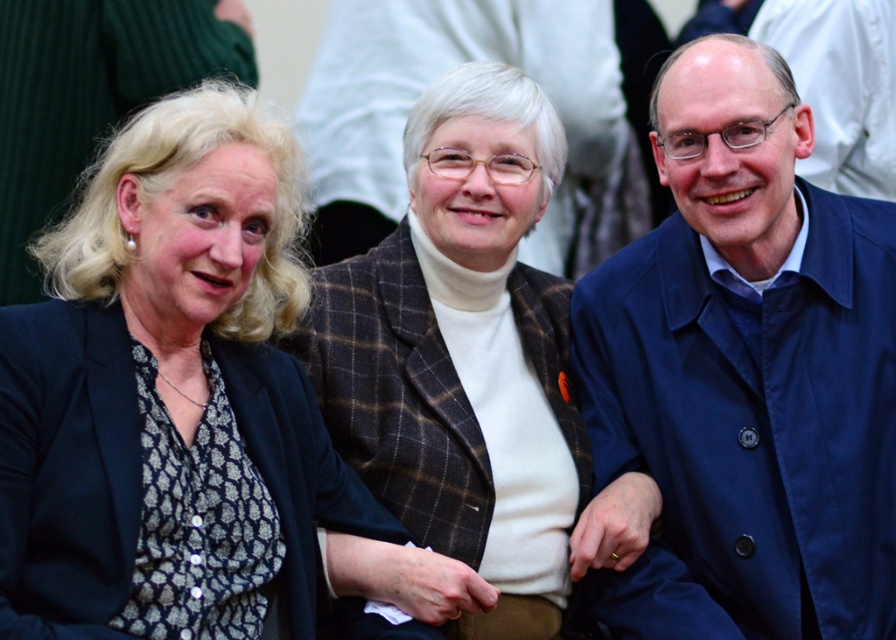
Who is shorter, matte black blazer at left or brown plaid blazer at center?

With less height is matte black blazer at left.

Who is positioned more to the right, matte black blazer at left or brown plaid blazer at center?

brown plaid blazer at center

Is point (102, 204) farther from viewer compared to point (507, 285)?

No, (102, 204) is in front of (507, 285).

Where is `matte black blazer at left`? Image resolution: width=896 pixels, height=640 pixels. matte black blazer at left is located at coordinates (164, 378).

Is blue fabric coat at right to the left of brown plaid blazer at center from the viewer's perspective?

No, blue fabric coat at right is not to the left of brown plaid blazer at center.

Is blue fabric coat at right bigger than brown plaid blazer at center?

No, blue fabric coat at right is not bigger than brown plaid blazer at center.

Where is `blue fabric coat at right`? The height and width of the screenshot is (640, 896). blue fabric coat at right is located at coordinates point(746,372).

Which of these two, blue fabric coat at right or matte black blazer at left, stands taller?

Standing taller between the two is blue fabric coat at right.

Does blue fabric coat at right have a lesser width compared to matte black blazer at left?

In fact, blue fabric coat at right might be wider than matte black blazer at left.

This screenshot has height=640, width=896. I want to click on blue fabric coat at right, so click(746, 372).